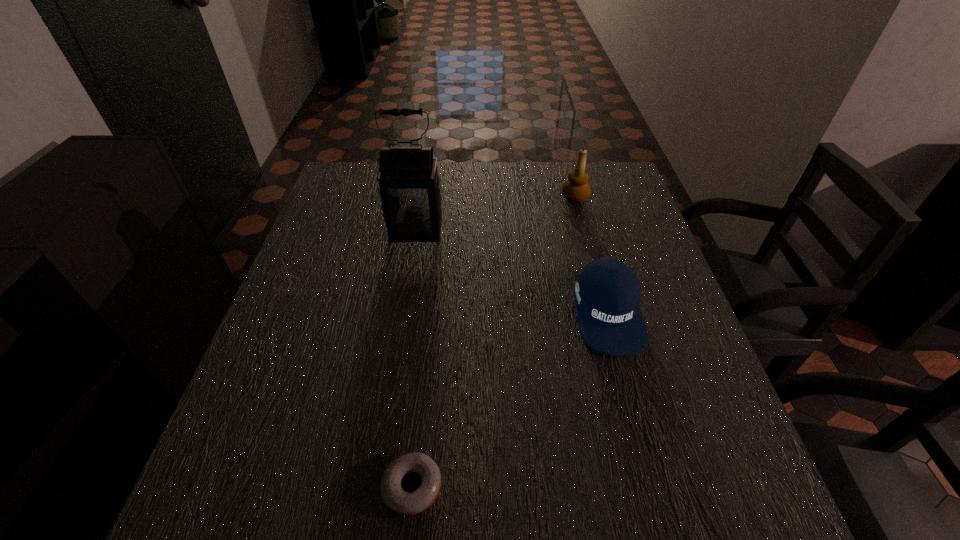
Find the location of a particular element. The image size is (960, 540). lantern is located at coordinates (410, 190).

Identify the location of the tallest object. Image resolution: width=960 pixels, height=540 pixels. (410, 190).

Image resolution: width=960 pixels, height=540 pixels. In order to click on the farthest object in this screenshot , I will do `click(576, 189)`.

The height and width of the screenshot is (540, 960). Identify the location of the second tallest object. (576, 189).

Find the location of `the third tallest object`. the third tallest object is located at coordinates (607, 293).

Identify the location of baseball cap. The image size is (960, 540). (607, 293).

The width and height of the screenshot is (960, 540). Find the location of `doughnut`. doughnut is located at coordinates (406, 503).

Where is `the shortest object`? This screenshot has height=540, width=960. the shortest object is located at coordinates (406, 503).

Locate an element on the screen. free space located 0.200m on the front-facing side of the tallest object is located at coordinates (404, 302).

Where is `free space located 0.200m on the left of the farthest object`? The height and width of the screenshot is (540, 960). free space located 0.200m on the left of the farthest object is located at coordinates (493, 197).